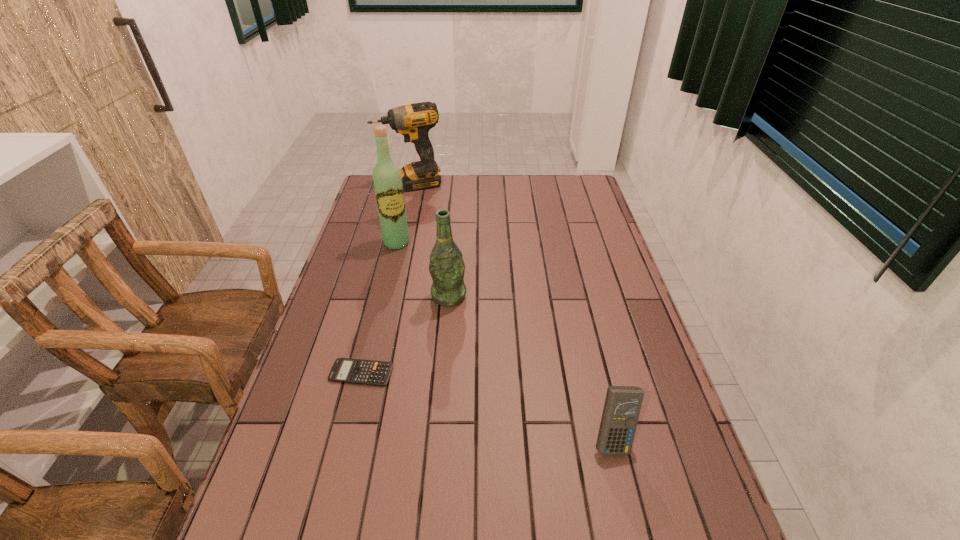
Locate an element on the screen. The width and height of the screenshot is (960, 540). the shortest object is located at coordinates (346, 370).

Identify the location of the left calculator. (346, 370).

Where is `the right calculator`? The width and height of the screenshot is (960, 540). the right calculator is located at coordinates (622, 406).

Where is `the nearer calculator`? The height and width of the screenshot is (540, 960). the nearer calculator is located at coordinates coord(622,406).

You are a GUI agent. You are given a task and a screenshot of the screen. Output one action in this format:
    pyautogui.click(x=<x>, y=<y>)
    Task: Click on the beer bottle
    
    Given the screenshot: What is the action you would take?
    pyautogui.click(x=446, y=266)

Image resolution: width=960 pixels, height=540 pixels. I want to click on the fourth object from left to right, so click(446, 266).

Find the location of a particular element. Image resolution: width=960 pixels, height=540 pixels. the tallest object is located at coordinates (387, 180).

This screenshot has height=540, width=960. I want to click on the fourth nearest object, so click(387, 180).

The width and height of the screenshot is (960, 540). Identify the location of drill. (413, 121).

Where is `free region located 0.060m on the left of the farther calculator`? Image resolution: width=960 pixels, height=540 pixels. free region located 0.060m on the left of the farther calculator is located at coordinates (307, 373).